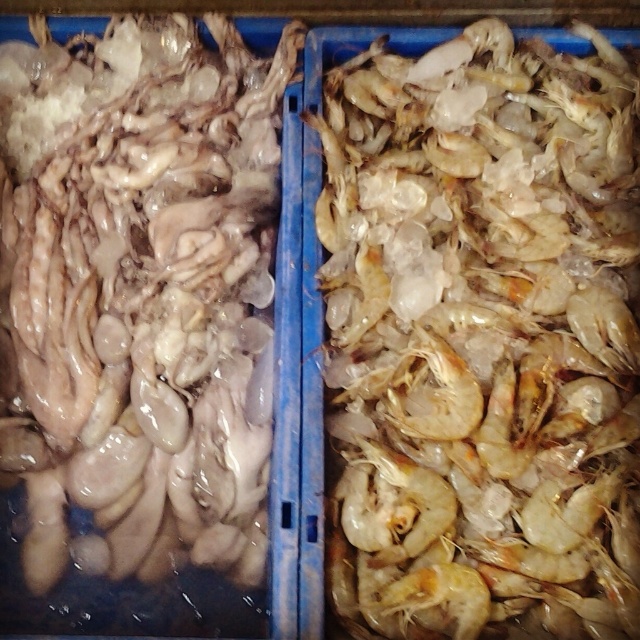
Identify the location of translucent white shrimp at right. The width and height of the screenshot is (640, 640). (483, 337).

How much distance is there between translucent white shrimp at right and translucent rubber squid at left?

translucent white shrimp at right and translucent rubber squid at left are 7.78 inches apart from each other.

I want to click on translucent white shrimp at right, so click(x=483, y=337).